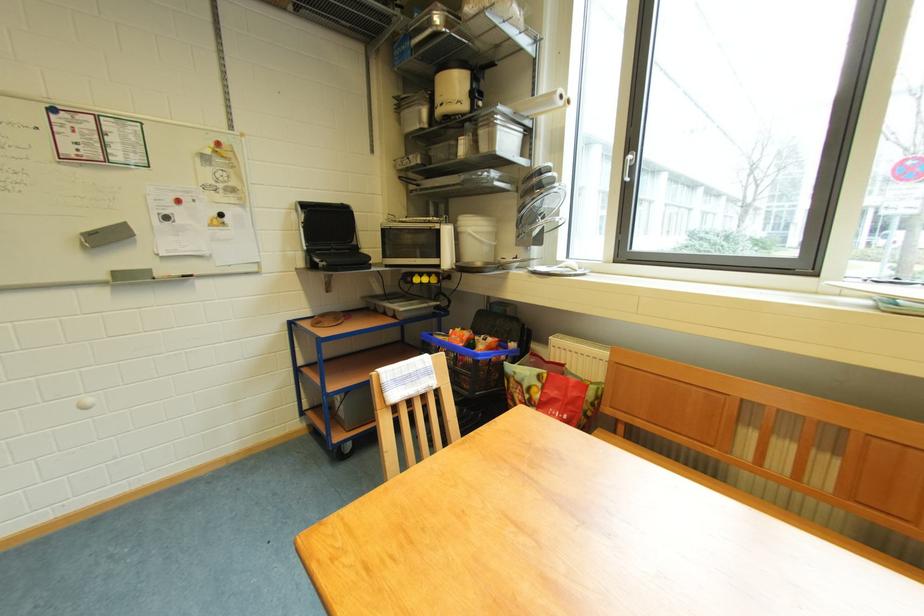
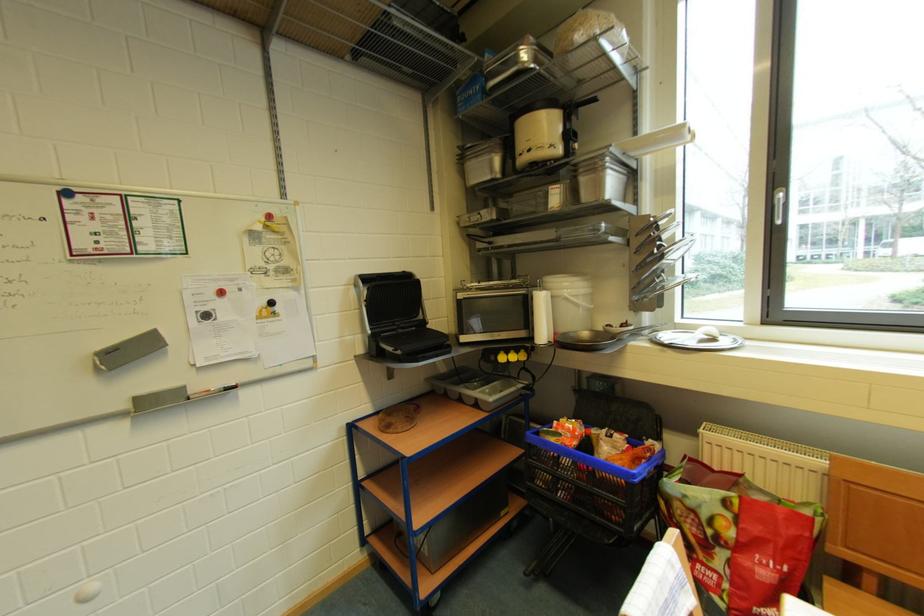
Find the pixel in the second image that matches point 95,248 in the first image.

(110, 370)